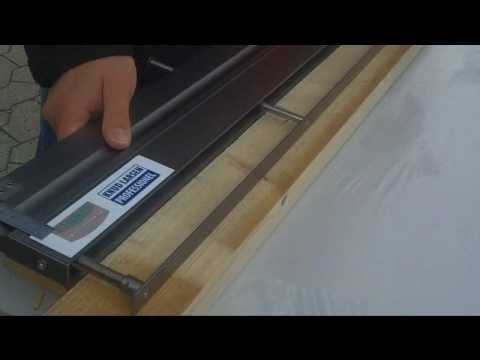
Image resolution: width=480 pixels, height=360 pixels. I want to click on tan wood, so click(217, 176).